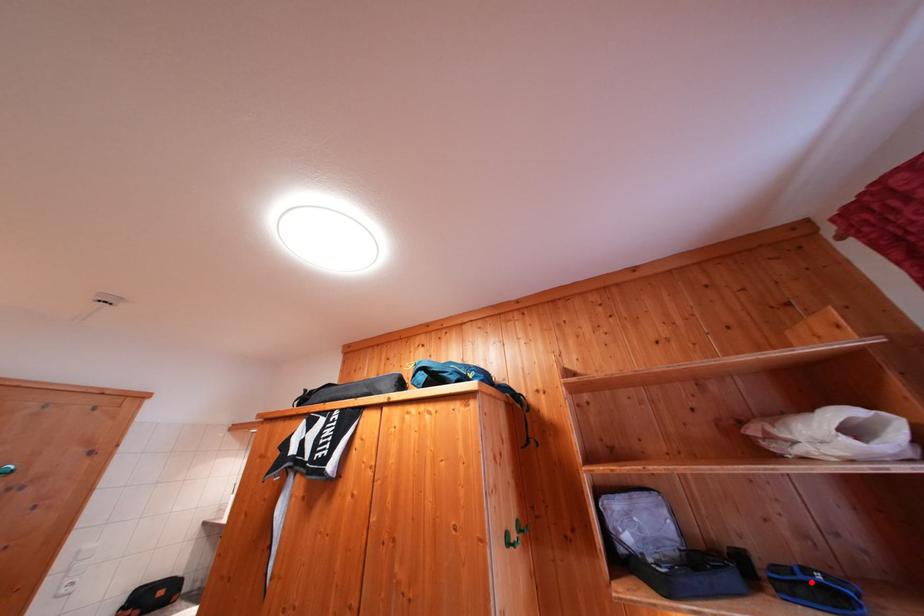
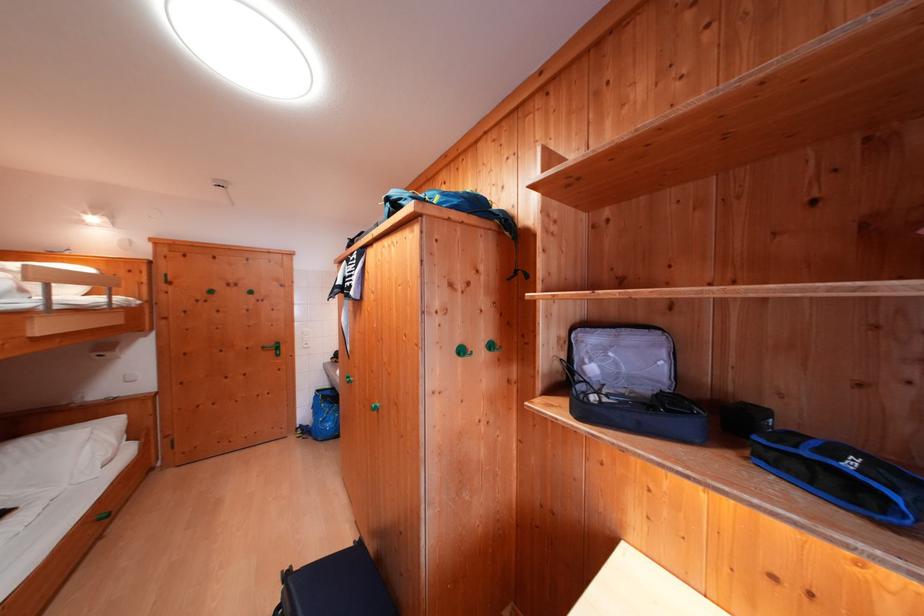
Question: I am providing you with two images of the same scene from different viewpoints. In image1, a red point is highlighted. Considering the same 3D point in image2, which of the following is correct?

Choices:
 (A) It is closer
 (B) It is farther

Answer: (B)